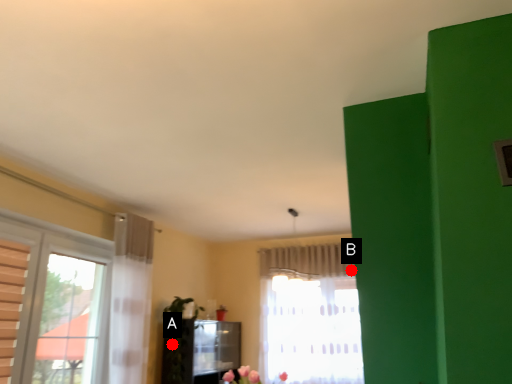
Question: Two points are circled on the image, labeled by A and B beside each circle. Which point is farther to the camera?

Choices:
 (A) A is further
 (B) B is further

Answer: (B)